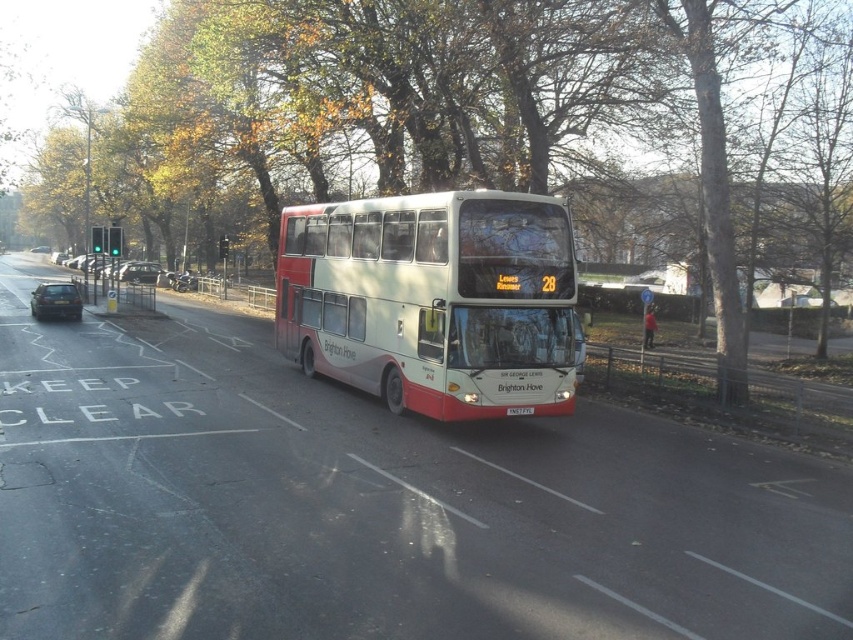
Does point (204, 204) come farther from viewer compared to point (79, 305)?

Yes, it is behind point (79, 305).

Between point (276, 49) and point (51, 285), which one is positioned in front?

Positioned in front is point (276, 49).

This screenshot has height=640, width=853. In order to click on green leafy tree at center in this screenshot , I will do `click(474, 140)`.

Does white matte double-decker bus at center have a lesser height compared to metallic silver car at center-left?

In fact, white matte double-decker bus at center may be taller than metallic silver car at center-left.

Does white matte double-decker bus at center have a smaller size compared to metallic silver car at center-left?

Indeed, white matte double-decker bus at center has a smaller size compared to metallic silver car at center-left.

Locate an element on the screen. white matte double-decker bus at center is located at coordinates (433, 300).

Does white matte double-decker bus at center appear over metallic silver car at left?

No.

Is point (383, 225) less distant than point (70, 304)?

Yes, it is.

Which is in front, point (399, 237) or point (51, 288)?

Point (399, 237)

I want to click on white matte double-decker bus at center, so click(433, 300).